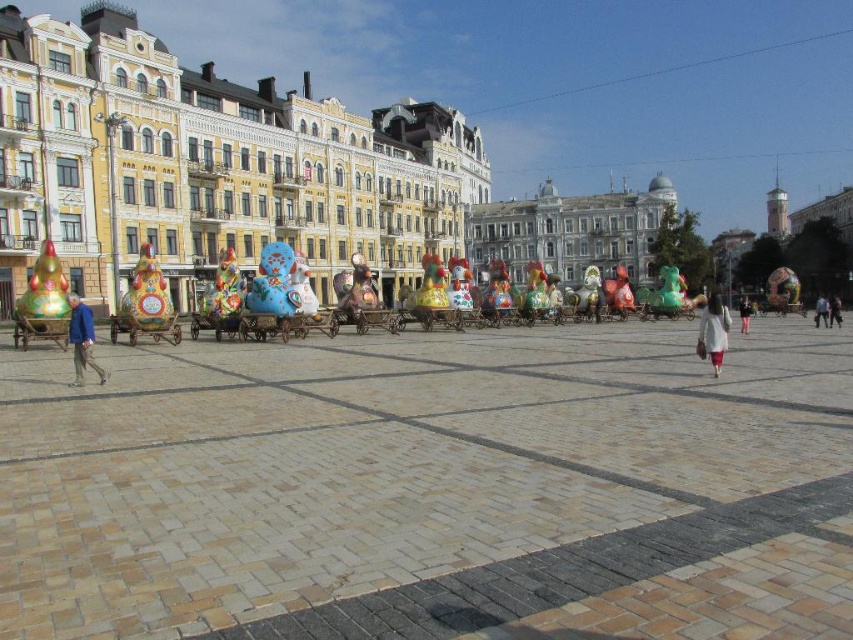
You are standing in the urban square and want to take a photo of the pink fabric dress at center without the blue denim jeans at lower right blocking the view. Is this possible based on their positions?

The pink fabric dress at center is behind the blue denim jeans at lower right, so taking a photo of the pink fabric dress at center without the blue denim jeans at lower right blocking the view is not possible because the dress is positioned behind the jeans.

You are standing in the urban square and see both the blue denim jacket at left and the pink fabric dress at center. Which object is closer to you?

The blue denim jacket at left is closer to you because it is in front of the pink fabric dress at center.